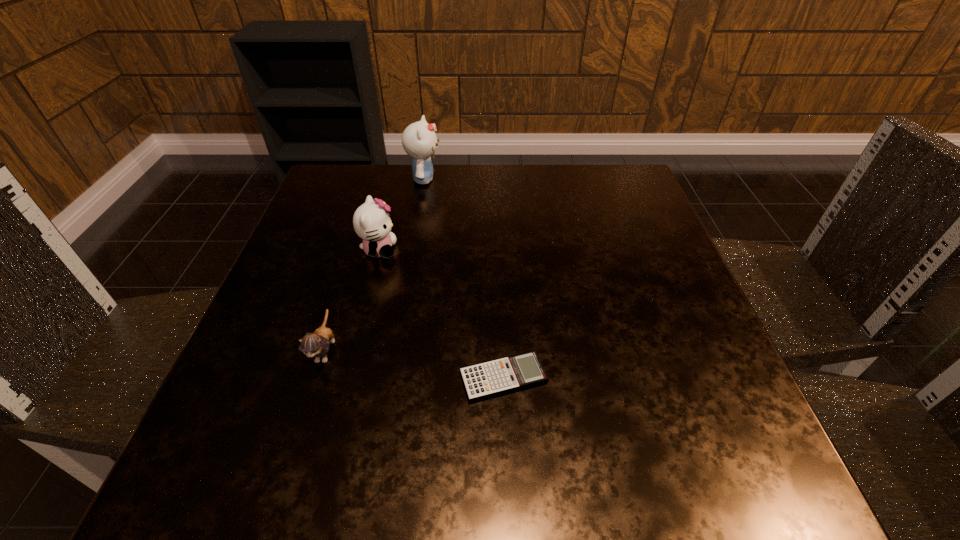
Locate an element on the screen. This screenshot has height=540, width=960. the tallest object is located at coordinates click(x=419, y=140).

Where is `the farthest object`? the farthest object is located at coordinates (419, 140).

I want to click on the second nearest kitten, so click(371, 222).

You are a GUI agent. You are given a task and a screenshot of the screen. Output one action in this format:
    pyautogui.click(x=<x>, y=<y>)
    Task: Click on the third shortest object
    Image resolution: width=960 pixels, height=540 pixels.
    Given the screenshot: What is the action you would take?
    pyautogui.click(x=371, y=222)

Locate an element on the screen. This screenshot has width=960, height=540. the second shortest object is located at coordinates (316, 344).

Locate an element on the screen. The width and height of the screenshot is (960, 540). the shortest kitten is located at coordinates (316, 344).

Locate an element on the screen. The width and height of the screenshot is (960, 540). the rightmost object is located at coordinates (511, 373).

Where is `calculator`? This screenshot has width=960, height=540. calculator is located at coordinates (511, 373).

The width and height of the screenshot is (960, 540). What are the coordinates of `free space located 0.200m on the front-facing side of the farthest object` in the screenshot? It's located at (520, 179).

The image size is (960, 540). Find the location of `vacant space located on the front-facing side of the second farthest object`. vacant space located on the front-facing side of the second farthest object is located at coordinates (532, 251).